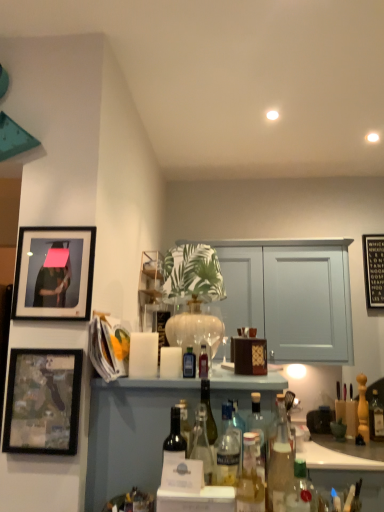
Question: Is dark glass bottle at center, which appears as the eighth bottle when viewed from the front, outside of dark glass bottle at center, the 9th bottle in the right-to-left sequence?

Choices:
 (A) yes
 (B) no

Answer: (A)

Question: Considering the relative sizes of dark glass bottle at center, which appears as the eighth bottle when viewed from the front, and dark glass bottle at center, marked as the 1th bottle in a left-to-right arrangement, in the image provided, is dark glass bottle at center, which appears as the eighth bottle when viewed from the front, bigger than dark glass bottle at center, marked as the 1th bottle in a left-to-right arrangement,?

Choices:
 (A) no
 (B) yes

Answer: (A)

Question: Is dark glass bottle at center, the 8th bottle from the right, to the left of dark glass bottle at center, marked as the 1th bottle in a left-to-right arrangement, from the viewer's perspective?

Choices:
 (A) no
 (B) yes

Answer: (A)

Question: Is dark glass bottle at center, marked as the 1th bottle in a left-to-right arrangement, surrounded by dark glass bottle at center, acting as the second bottle starting from the back?

Choices:
 (A) no
 (B) yes

Answer: (A)

Question: Considering the relative sizes of dark glass bottle at center, the 8th bottle from the right, and dark glass bottle at center, arranged as the seventh bottle when viewed from the back, in the image provided, is dark glass bottle at center, the 8th bottle from the right, wider than dark glass bottle at center, arranged as the seventh bottle when viewed from the back,?

Choices:
 (A) yes
 (B) no

Answer: (A)

Question: Is point (94, 239) positioned closer to the camera than point (97, 500)?

Choices:
 (A) closer
 (B) farther

Answer: (B)

Question: Based on their positions, is matte black picture frame at upper left, arranged as the 2th picture frame when viewed from the left, located to the left or right of translucent glass bottles at center?

Choices:
 (A) right
 (B) left

Answer: (B)

Question: In terms of height, does matte black picture frame at upper left, arranged as the 2th picture frame when viewed from the left, look taller or shorter compared to translucent glass bottles at center?

Choices:
 (A) short
 (B) tall

Answer: (A)

Question: Is matte black picture frame at upper left, arranged as the 2th picture frame when viewed from the left, bigger or smaller than translucent glass bottles at center?

Choices:
 (A) big
 (B) small

Answer: (B)

Question: Is point (301, 498) positioned closer to the camera than point (148, 276)?

Choices:
 (A) closer
 (B) farther

Answer: (A)

Question: Considering the positions of translucent glass bottle at lower right, which is the 2th bottle from right to left, and wooden at upper center in the image, is translucent glass bottle at lower right, which is the 2th bottle from right to left, taller or shorter than wooden at upper center?

Choices:
 (A) tall
 (B) short

Answer: (B)

Question: Looking at their shapes, would you say translucent glass bottle at lower right, which is the 2th bottle from right to left, is wider or thinner than wooden at upper center?

Choices:
 (A) thin
 (B) wide

Answer: (A)

Question: In the image, is translucent glass bottle at lower right, the 8th bottle in the left-to-right sequence, positioned in front of or behind wooden at upper center?

Choices:
 (A) front
 (B) behind

Answer: (A)

Question: Is clear glass bottle at center, the sixth bottle in the left-to-right sequence, wider or thinner than translucent glass bottles at center?

Choices:
 (A) thin
 (B) wide

Answer: (A)

Question: Is clear glass bottle at center, the sixth bottle in the left-to-right sequence, taller or shorter than translucent glass bottles at center?

Choices:
 (A) short
 (B) tall

Answer: (A)